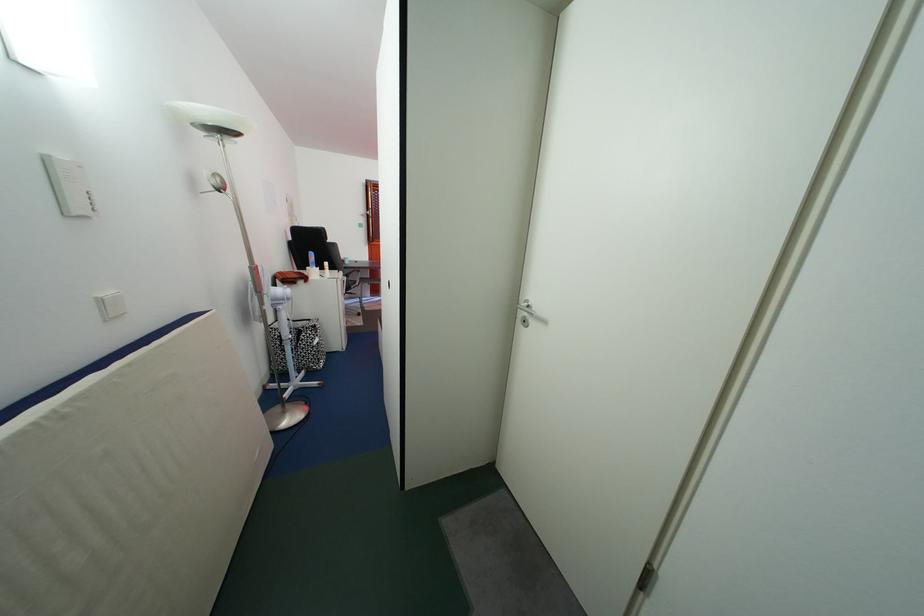
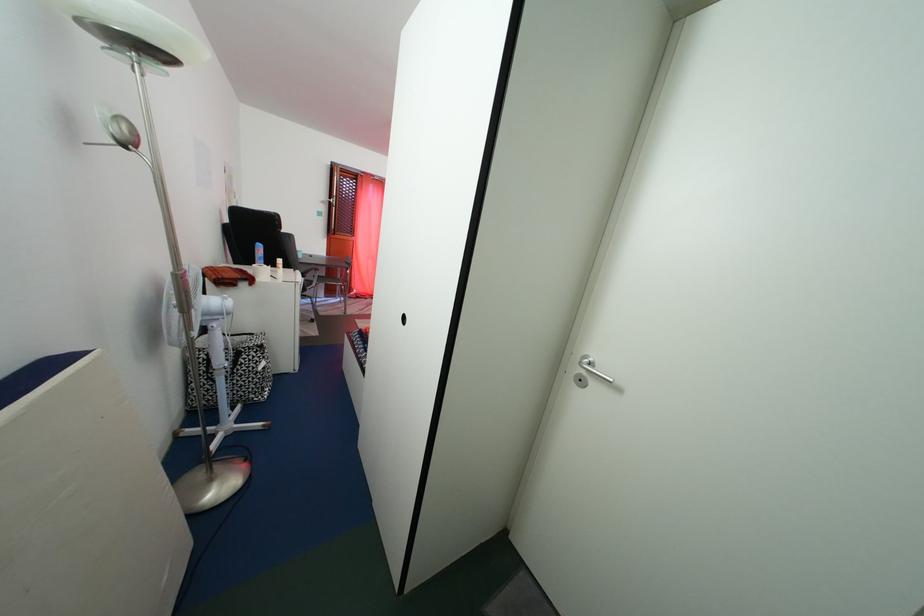
The images are taken continuously from a first-person perspective. In which direction are you moving?

The cameraman moved toward left, forward.